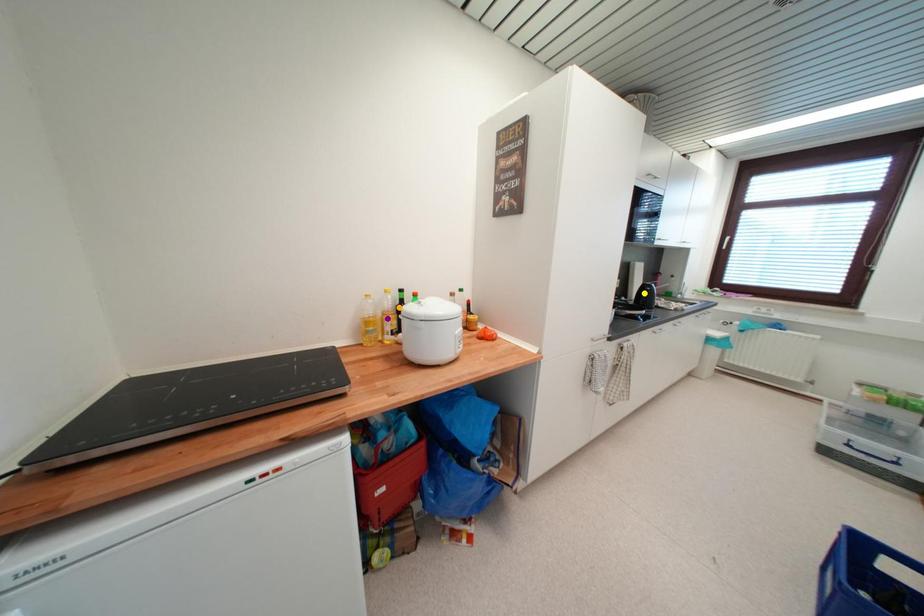
Order these from nearest to farthest:
purple point, yellow point, orange point

purple point → orange point → yellow point